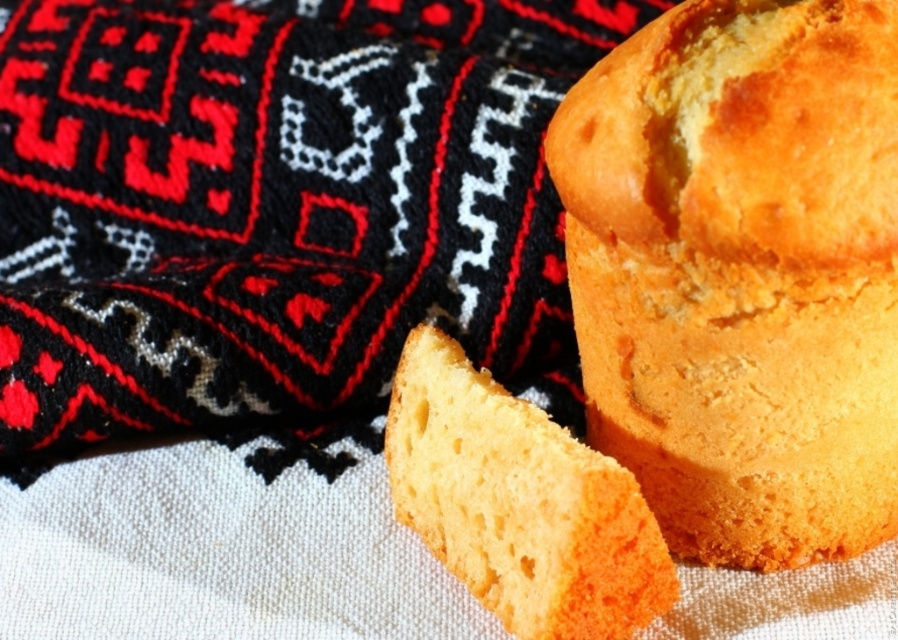
Question: Which object appears farthest from the camera in this image?

Choices:
 (A) yellow sponge cake at center
 (B) golden sponge muffin at center

Answer: (A)

Question: Is golden sponge muffin at center to the left of yellow sponge cake at center from the viewer's perspective?

Choices:
 (A) no
 (B) yes

Answer: (A)

Question: Observing the image, what is the correct spatial positioning of golden sponge muffin at center in reference to yellow sponge cake at center?

Choices:
 (A) left
 (B) right

Answer: (B)

Question: Is golden sponge muffin at center below yellow sponge cake at center?

Choices:
 (A) yes
 (B) no

Answer: (B)

Question: Which point is farther to the camera?

Choices:
 (A) (521, 522)
 (B) (850, 547)

Answer: (B)